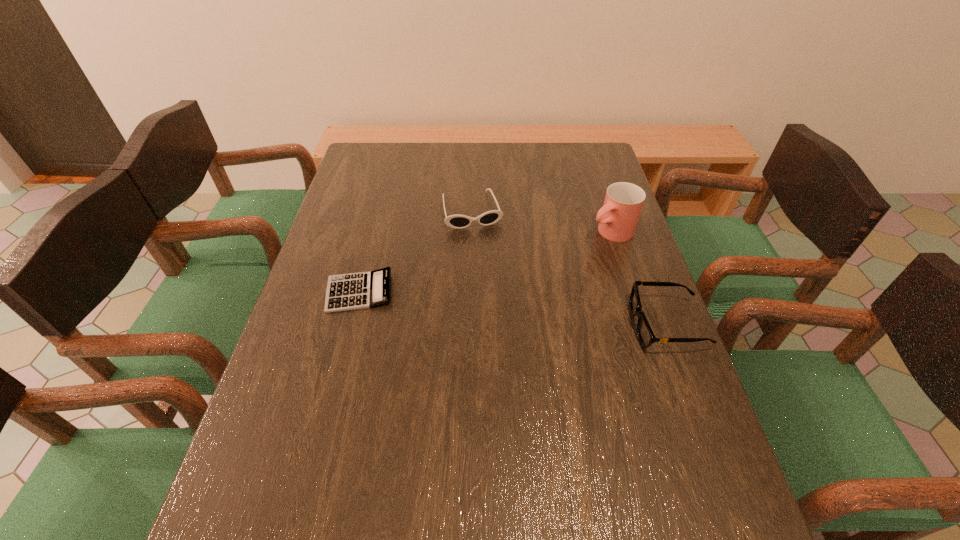
This screenshot has width=960, height=540. What are the coordinates of `free space on the desktop that is between the shortest object and the right sunglasses and is positioned on the side of the tallest object with the handle` in the screenshot? It's located at (475, 304).

The image size is (960, 540). Find the location of `vacant space on the desktop that is between the shortest object and the right sunglasses and is positioned with the lenses of the left sunglasses facing outward`. vacant space on the desktop that is between the shortest object and the right sunglasses and is positioned with the lenses of the left sunglasses facing outward is located at coordinates (500, 307).